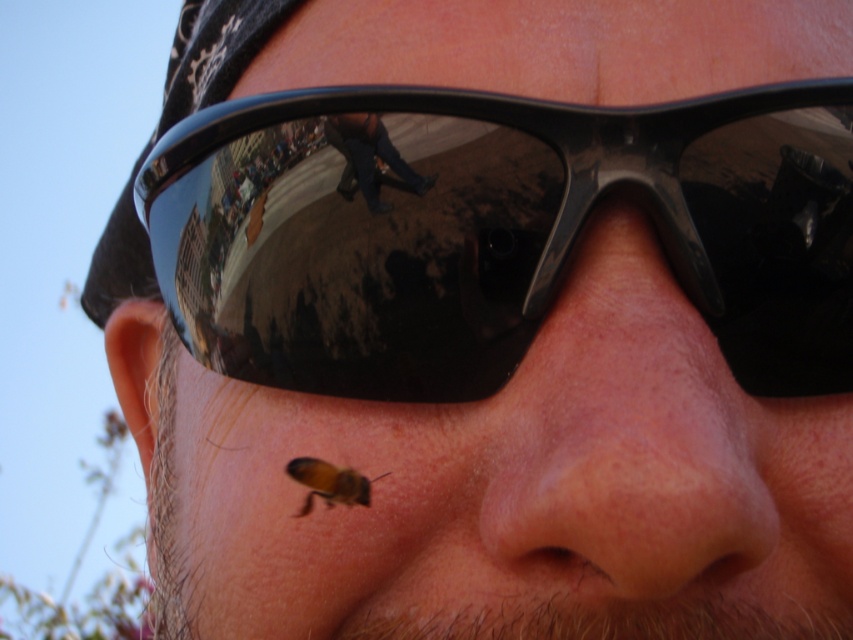
Question: Which object is farther from the camera taking this photo?

Choices:
 (A) brown fuzzy bee at lower right
 (B) pink smooth skin at center
 (C) black reflective sunglasses at upper center

Answer: (C)

Question: Can you confirm if pink smooth skin at center is positioned below brown fuzzy bee at lower right?

Choices:
 (A) no
 (B) yes

Answer: (A)

Question: Which point is closer to the camera?

Choices:
 (A) (729, 438)
 (B) (383, 269)
 (C) (303, 456)

Answer: (A)

Question: Is black reflective sunglasses at upper center to the left of brown fuzzy bee at lower right from the viewer's perspective?

Choices:
 (A) yes
 (B) no

Answer: (B)

Question: Does black reflective sunglasses at upper center appear on the left side of pink smooth skin at center?

Choices:
 (A) yes
 (B) no

Answer: (A)

Question: Which point appears closest to the camera in this image?

Choices:
 (A) (326, 374)
 (B) (366, 500)

Answer: (B)